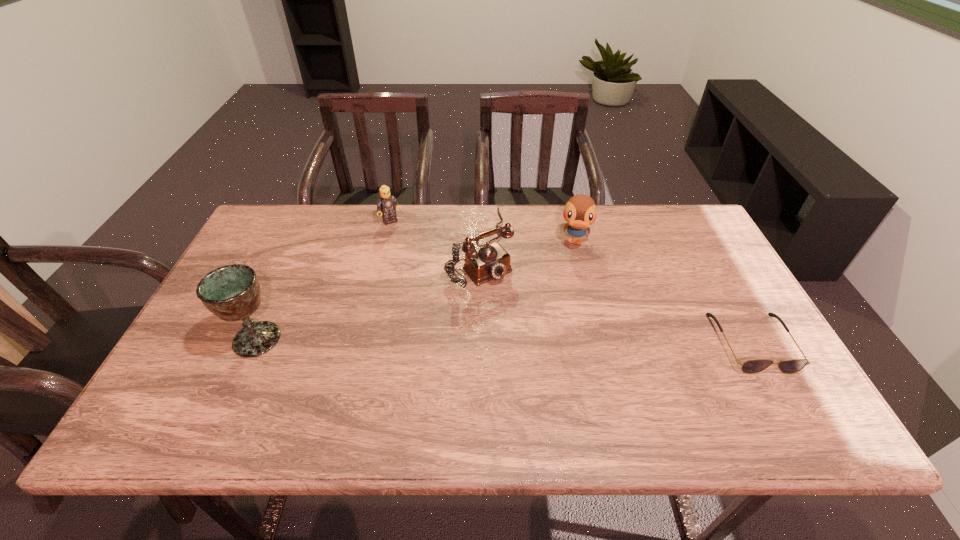
The height and width of the screenshot is (540, 960). I want to click on vacant area that lies between the telephone and the second object from left to right, so click(435, 234).

You are a GUI agent. You are given a task and a screenshot of the screen. Output one action in this format:
    pyautogui.click(x=<x>, y=<y>)
    Task: Click on the free area in between the third object from right to left and the second object from left to right
    This screenshot has width=960, height=540.
    Given the screenshot: What is the action you would take?
    pyautogui.click(x=435, y=234)

Locate an element on the screen. This screenshot has height=540, width=960. vacant area that lies between the chalice and the second object from left to right is located at coordinates (324, 280).

The width and height of the screenshot is (960, 540). What are the coordinates of `free space between the duck and the tallest object` in the screenshot? It's located at (417, 291).

I want to click on empty space between the Lego and the sunglasses, so click(x=571, y=282).

Identify the location of free space between the leftmost object and the third object from left to right. (368, 293).

Locate an element on the screen. This screenshot has width=960, height=540. unoccupied position between the telephone and the duck is located at coordinates (527, 244).

Find the location of a particular element. The image size is (960, 540). vacant space that is in between the telephone and the sunglasses is located at coordinates (615, 294).

Identify the location of free space between the telephone and the leftmost object. (368, 293).

I want to click on object that can be found as the fourth closest to the fourth object from right to left, so click(753, 366).